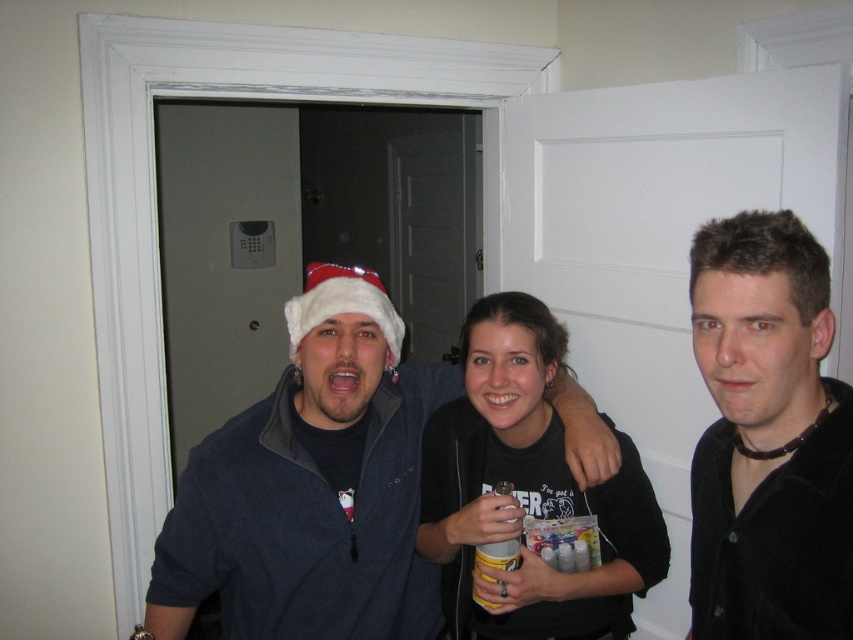
Looking at this image, you are trying to decide which clothing item to wear for a casual gathering. Based on the image, which of the following items is larger in size between the dark blue fleece jacket at center and the black velvet shirt at center?

The dark blue fleece jacket at center has a larger size compared to the black velvet shirt at center, so you should choose the dark blue fleece jacket at center if you want a larger size.

You are standing in the room and need to find the dark blue fleece jacket at center. According to the coordinates provided, where exactly is it positioned?

The dark blue fleece jacket at center is located at point 0.761 on the x axis and 0.366 on the y axis.

You are a photographer trying to capture the scene. The black velvet shirt at center is at point (x=769, y=436). Where should you position your camera to ensure the black velvet shirt at center is in the frame?

The black velvet shirt at center is already at point (x=769, y=436), so positioning the camera to include that coordinate will keep it in frame.